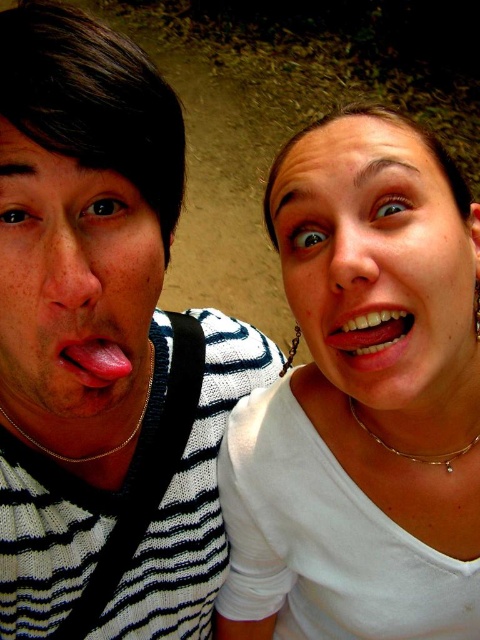
You are designing a photo frame that needs to accommodate both the striped knit sweater at left and the smooth pink tongue at center. Given their widths, which object should you prioritize in terms of horizontal space allocation?

The striped knit sweater at left should be prioritized for horizontal space allocation because its width is greater than the smooth pink tongue at center.

You are a photographer trying to capture a closeup shot of both the smooth white face at center and the glossy white teeth at center in the image. The camera you are using has a focus range of 5 inches. Can both subjects be in focus at the same time?

The smooth white face at center and glossy white teeth at center are 5.76 inches apart from each other. Since the camera has a focus range of 5 inches, the distance between them exceeds the focus range. Therefore, both subjects cannot be in focus simultaneously.

You are taking a selfie with two friends and want to ensure everyone is in focus. The camera you are using has a depth of field that can sharply capture objects within 25 inches of the focal point. If you focus on the point at coordinates point (22,429), will both people in the image be in focus?

The distance of point (22,429) from camera is 26.03 inches. Since the depth of field can only sharply capture objects within 25 inches, focusing on this point would mean the subjects are slightly beyond the optimal range, potentially causing them to be slightly out of focus.